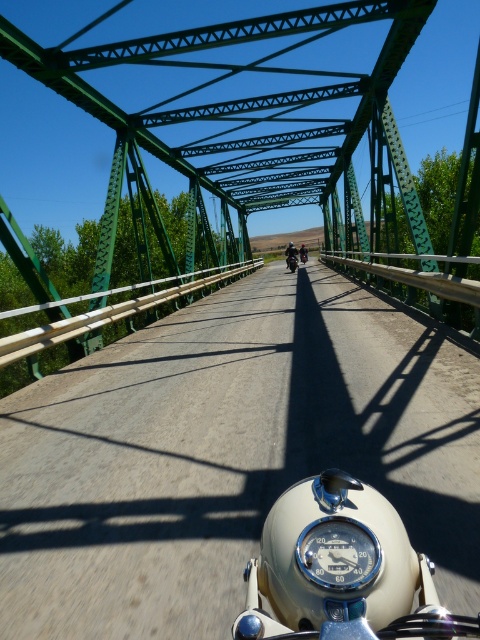
Question: Which point appears closest to the camera in this image?

Choices:
 (A) (264, 576)
 (B) (153, 113)
 (C) (299, 252)
 (D) (295, 250)

Answer: (A)

Question: Which point is farther to the camera?

Choices:
 (A) green metallic bridge at center
 (B) shiny black motorcycle at center

Answer: (B)

Question: Is white glossy speedometer at center positioned in front of shiny chrome helmet at center?

Choices:
 (A) no
 (B) yes

Answer: (B)

Question: Is green metallic bridge at center further to camera compared to shiny chrome helmet at center?

Choices:
 (A) yes
 (B) no

Answer: (B)

Question: Which point is closer to the camera?

Choices:
 (A) (304, 253)
 (B) (289, 252)

Answer: (B)

Question: Is white glossy speedometer at center to the left of shiny black motorcycle at center from the viewer's perspective?

Choices:
 (A) no
 (B) yes

Answer: (B)